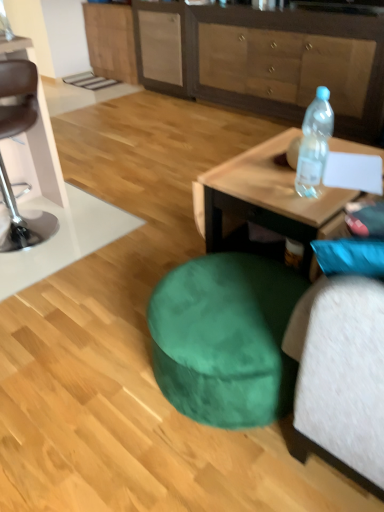
Locate an element on the screen. This screenshot has width=384, height=512. vacant region to the left of wooden coffee table at right is located at coordinates (142, 268).